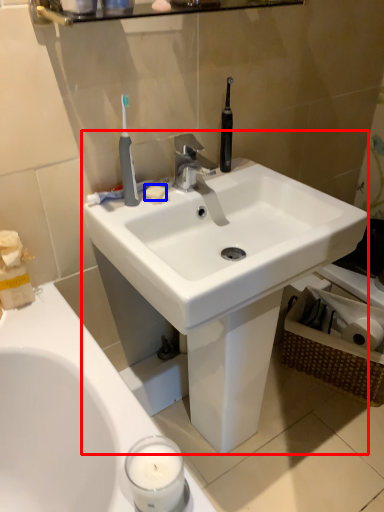
Question: Which of the following is the farthest to the observer, sink (highlighted by a red box) or soap (highlighted by a blue box)?

Choices:
 (A) sink
 (B) soap

Answer: (B)